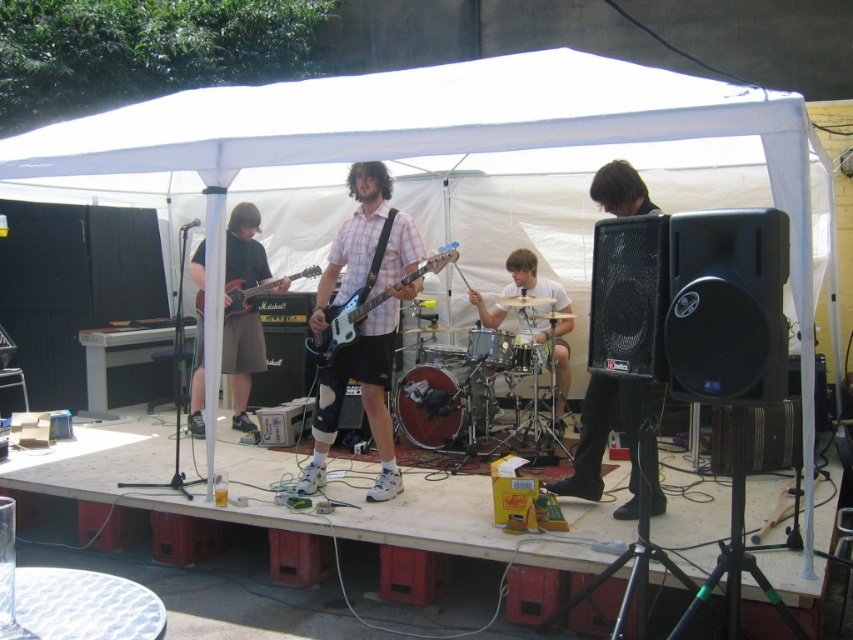
Question: Which object is the closest to the plaid shirt at center?

Choices:
 (A) white drum set at center
 (B) black matte speaker at right

Answer: (B)

Question: Is plaid shirt at center to the left of matte black guitar at left from the viewer's perspective?

Choices:
 (A) yes
 (B) no

Answer: (B)

Question: Is plaid shirt at center behind matte black guitar at left?

Choices:
 (A) yes
 (B) no

Answer: (B)

Question: Among these points, which one is nearest to the camera?

Choices:
 (A) (280, 291)
 (B) (543, 289)

Answer: (A)

Question: Is plaid shirt at center to the left of matte black guitar at left from the viewer's perspective?

Choices:
 (A) yes
 (B) no

Answer: (B)

Question: Among these points, which one is farthest from the camera?

Choices:
 (A) (231, 291)
 (B) (364, 196)

Answer: (A)